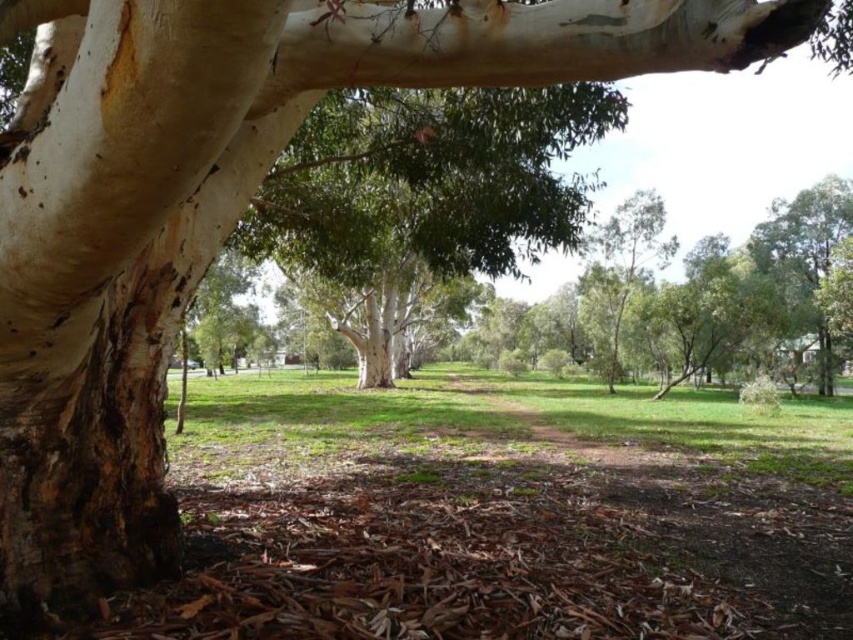
Question: Which point appears closest to the camera in this image?

Choices:
 (A) (750, 428)
 (B) (26, 536)
 (C) (286, 176)

Answer: (B)

Question: Among these points, which one is nearest to the camera?

Choices:
 (A) (105, 353)
 (B) (492, 144)

Answer: (A)

Question: Based on their relative distances, which object is nearer to the green leafy tree at center?

Choices:
 (A) white rough bark tree trunk at left
 (B) green grass at center

Answer: (B)

Question: Does white rough bark tree trunk at left have a larger size compared to green leafy tree at center?

Choices:
 (A) no
 (B) yes

Answer: (A)

Question: Considering the relative positions of white rough bark tree trunk at left and green leafy tree at center in the image provided, where is white rough bark tree trunk at left located with respect to green leafy tree at center?

Choices:
 (A) below
 (B) above

Answer: (A)

Question: Is white rough bark tree trunk at left in front of green grass at center?

Choices:
 (A) no
 (B) yes

Answer: (B)